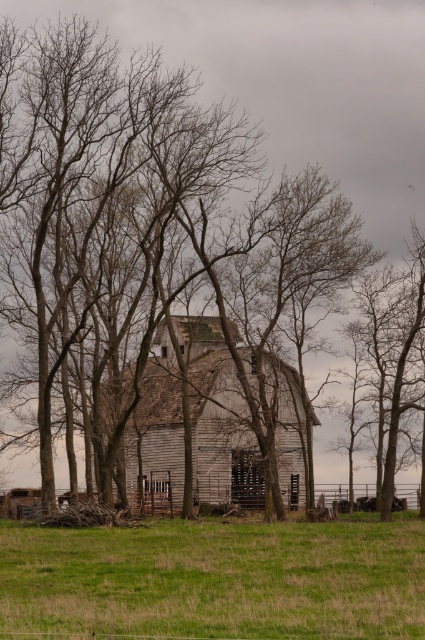
You are standing at the origin point in the image. The weathered wood barn at center is at coordinates 0.655, 0.513. If you want to move directly towards it, in which direction should you head?

The weathered wood barn at center is located at point (218, 419), so you should move towards the coordinates (218, 419) to reach it directly.

You are standing in the middle of the green grassy field at lower center and want to reach the weathered wood barn at center. Which direction should you move to get closer to the barn?

You should move to the right because the green grassy field at lower center is positioned on the left side of the weathered wood barn at center, so moving right would bring you closer to the barn.